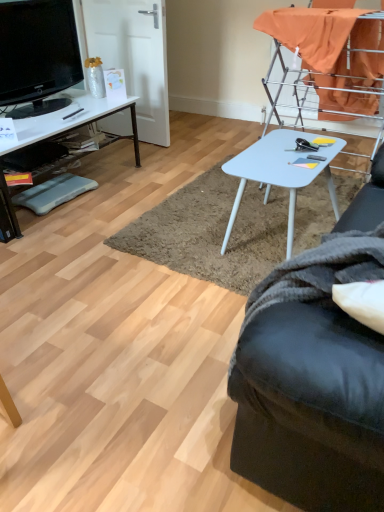
Measure the distance between black fabric studio couch at lower right and camera.

They are 28.81 inches apart.

This screenshot has height=512, width=384. Describe the element at coordinates (53, 193) in the screenshot. I see `blue foam footrest at lower left` at that location.

Locate an element on the screen. The height and width of the screenshot is (512, 384). black glossy television at upper left is located at coordinates (37, 55).

Measure the distance between point [62,101] and camera.

A distance of 9.10 feet exists between point [62,101] and camera.

This screenshot has height=512, width=384. I want to click on white plastic table at center, so click(x=331, y=57).

Measure the distance between white glossy desk at left and camera.

The depth of white glossy desk at left is 6.73 feet.

Describe the element at coordinates (281, 172) in the screenshot. This screenshot has height=512, width=384. I see `light blue plastic table at center` at that location.

You are a GUI agent. You are given a task and a screenshot of the screen. Output one action in this format:
    pyautogui.click(x=<x>, y=<y>)
    Task: Click on the black fabric studio couch at lower right
    The image size is (384, 512).
    Given the screenshot: What is the action you would take?
    pyautogui.click(x=311, y=408)

Is white plastic table at center touching light blue plastic table at center?

No.

From the image's perspective, is white plastic table at center located above light blue plastic table at center?

Yes, from the image's perspective, white plastic table at center is over light blue plastic table at center.

Consider the image. Is white plastic table at center looking in the opposite direction of light blue plastic table at center?

No, white plastic table at center is not facing away from light blue plastic table at center.

Considering the points (350, 106) and (292, 145), which point is behind, point (350, 106) or point (292, 145)?

The point (350, 106) is more distant.

Which object is positioned more to the right, white glossy desk at left or light blue plastic table at center?

light blue plastic table at center is more to the right.

From the image's perspective, is white glossy desk at left located above or below light blue plastic table at center?

From the image's perspective, white glossy desk at left appears above light blue plastic table at center.

Does white glossy desk at left have a lesser height compared to light blue plastic table at center?

Incorrect, the height of white glossy desk at left does not fall short of that of light blue plastic table at center.

From a real-world perspective, is white glossy desk at left positioned above or below light blue plastic table at center?

white glossy desk at left is above light blue plastic table at center.

Which of these two, light blue plastic table at center or black plastic pen at left, stands shorter?

black plastic pen at left.

Can you confirm if light blue plastic table at center is wider than black plastic pen at left?

Yes, light blue plastic table at center is wider than black plastic pen at left.

How distant is light blue plastic table at center from black plastic pen at left?

They are 4.41 feet apart.

From the picture: Is white plastic table at center spatially inside black plastic pen at left, or outside of it?

white plastic table at center is spatially situated outside black plastic pen at left.

Considering the relative sizes of white plastic table at center and black plastic pen at left in the image provided, is white plastic table at center shorter than black plastic pen at left?

In fact, white plastic table at center may be taller than black plastic pen at left.

From the image's perspective, which one is positioned lower, white plastic table at center or black plastic pen at left?

black plastic pen at left appears lower in the image.

Does white plastic table at center have a larger size compared to black plastic pen at left?

Yes, white plastic table at center is bigger than black plastic pen at left.

Is black glossy television at upper left at the back of blue foam footrest at lower left?

No.

Considering the sizes of objects blue foam footrest at lower left and black glossy television at upper left in the image provided, who is taller, blue foam footrest at lower left or black glossy television at upper left?

black glossy television at upper left.

Is point (21, 193) positioned after point (63, 4)?

Yes, it is.

Is blue foam footrest at lower left positioned beyond the bounds of black glossy television at upper left?

Yes, blue foam footrest at lower left is not within black glossy television at upper left.

From the image's perspective, which object appears higher, black fabric studio couch at lower right or black plastic pen at left?

black plastic pen at left.

Is the surface of black fabric studio couch at lower right in direct contact with black plastic pen at left?

No, black fabric studio couch at lower right is not touching black plastic pen at left.

Could you tell me if black fabric studio couch at lower right is facing black plastic pen at left?

No, black fabric studio couch at lower right is not turned towards black plastic pen at left.

Does black fabric studio couch at lower right appear on the left side of black plastic pen at left?

Incorrect, black fabric studio couch at lower right is not on the left side of black plastic pen at left.

Considering the relative positions of white glossy desk at left and black fabric studio couch at lower right in the image provided, is white glossy desk at left to the left of black fabric studio couch at lower right from the viewer's perspective?

Yes.

Is white glossy desk at left facing towards black fabric studio couch at lower right?

Yes, white glossy desk at left is turned towards black fabric studio couch at lower right.

Identify the location of desk above the black fabric studio couch at lower right (from the image's perspective). This screenshot has height=512, width=384. (69, 122).

From the image's perspective, would you say white glossy desk at left is shown under black fabric studio couch at lower right?

Actually, white glossy desk at left appears above black fabric studio couch at lower right in the image.

Identify the location of chair on the right of light blue plastic table at center. pos(331,57).

In order to click on desk behind the light blue plastic table at center in this screenshot , I will do `click(69, 122)`.

Which object lies nearer to the anchor point blue foam footrest at lower left, white plastic table at center or black glossy television at upper left?

black glossy television at upper left lies closer to blue foam footrest at lower left than the other object.

Estimate the real-world distances between objects in this image. Which object is closer to blue foam footrest at lower left, black fabric studio couch at lower right or white plastic table at center?

white plastic table at center.

Looking at the image, which one is located further to white glossy desk at left, white plastic table at center or blue foam footrest at lower left?

white plastic table at center lies further to white glossy desk at left than the other object.

From the image, which object appears to be nearer to black plastic pen at left, white plastic table at center or blue foam footrest at lower left?

blue foam footrest at lower left lies closer to black plastic pen at left than the other object.

Which object lies further to the anchor point black fabric studio couch at lower right, white plastic table at center or light blue plastic table at center?

white plastic table at center lies further to black fabric studio couch at lower right than the other object.

When comparing their distances from black plastic pen at left, does light blue plastic table at center or white plastic table at center seem closer?

Among the two, light blue plastic table at center is located nearer to black plastic pen at left.

From the image, which object appears to be farther from black fabric studio couch at lower right, black plastic pen at left or blue foam footrest at lower left?

black plastic pen at left is further to black fabric studio couch at lower right.

From the picture: When comparing their distances from white glossy desk at left, does blue foam footrest at lower left or black glossy television at upper left seem further?

Among the two, blue foam footrest at lower left is located further to white glossy desk at left.

Where is `television between white glossy desk at left and white plastic table at center`? The width and height of the screenshot is (384, 512). television between white glossy desk at left and white plastic table at center is located at coordinates (37, 55).

The image size is (384, 512). I want to click on pen located between white glossy desk at left and light blue plastic table at center in the left-right direction, so click(x=73, y=114).

Image resolution: width=384 pixels, height=512 pixels. Find the location of `table between white glossy desk at left and white plastic table at center from left to right`. table between white glossy desk at left and white plastic table at center from left to right is located at coordinates pos(281,172).

Identify the location of studio couch between black glossy television at upper left and white plastic table at center in the horizontal direction. The image size is (384, 512). (311, 408).